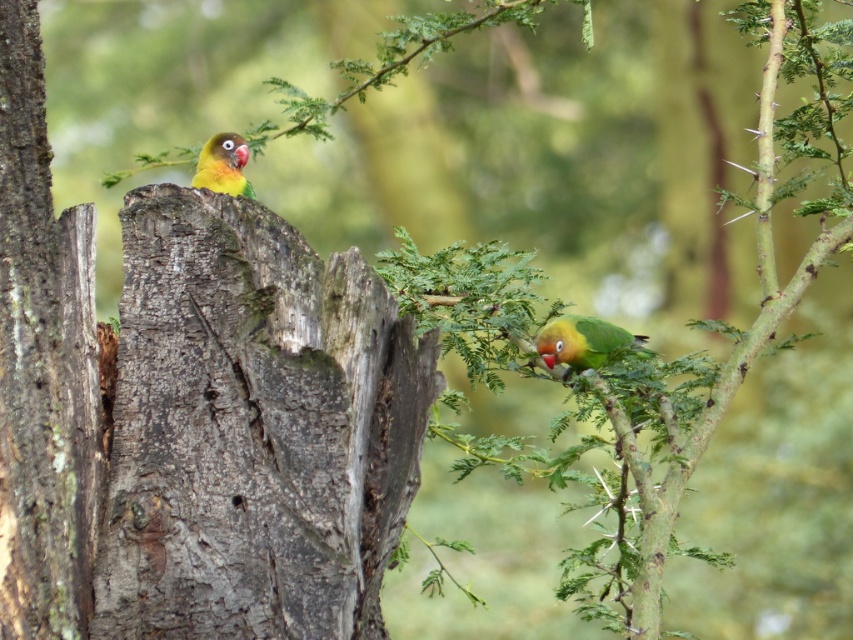
Question: Does gray rough bark tree trunk at left appear under yellow-green parrot at upper left?

Choices:
 (A) yes
 (B) no

Answer: (A)

Question: Which object is the closest to the green matte parrot at right?

Choices:
 (A) yellow-green parrot at upper left
 (B) gray rough bark tree trunk at left
 (C) rough bark tree trunk at left

Answer: (A)

Question: Estimate the real-world distances between objects in this image. Which object is farther from the yellow-green parrot at upper left?

Choices:
 (A) rough bark tree trunk at left
 (B) green matte parrot at right
 (C) gray rough bark tree trunk at left

Answer: (A)

Question: Does rough bark tree trunk at left have a smaller size compared to yellow-green parrot at upper left?

Choices:
 (A) no
 (B) yes

Answer: (B)

Question: Which object is closer to the camera taking this photo?

Choices:
 (A) gray rough bark tree trunk at left
 (B) rough bark tree trunk at left
 (C) green matte parrot at right
 (D) yellow-green parrot at upper left

Answer: (A)

Question: Can you confirm if gray rough bark tree trunk at left is positioned to the right of green matte parrot at right?

Choices:
 (A) no
 (B) yes

Answer: (A)